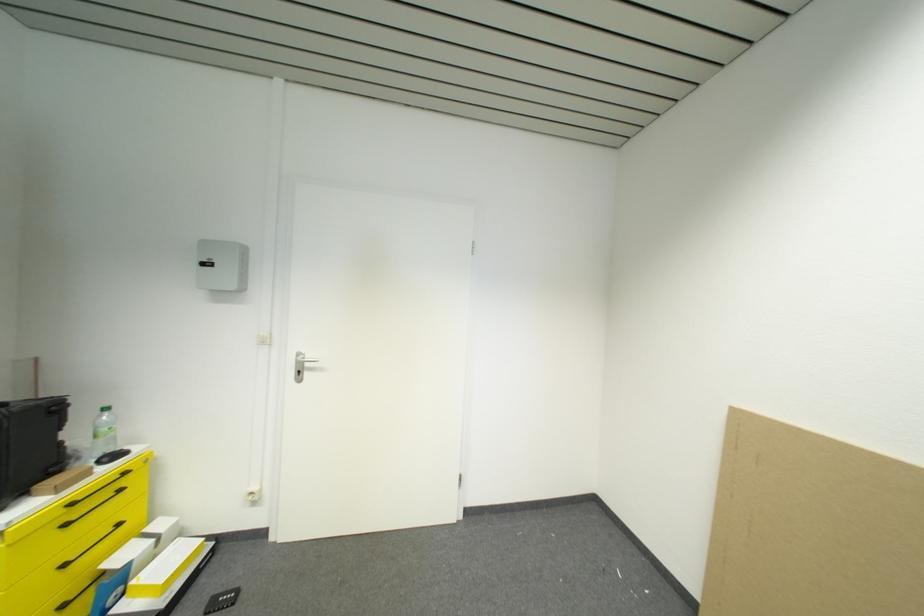
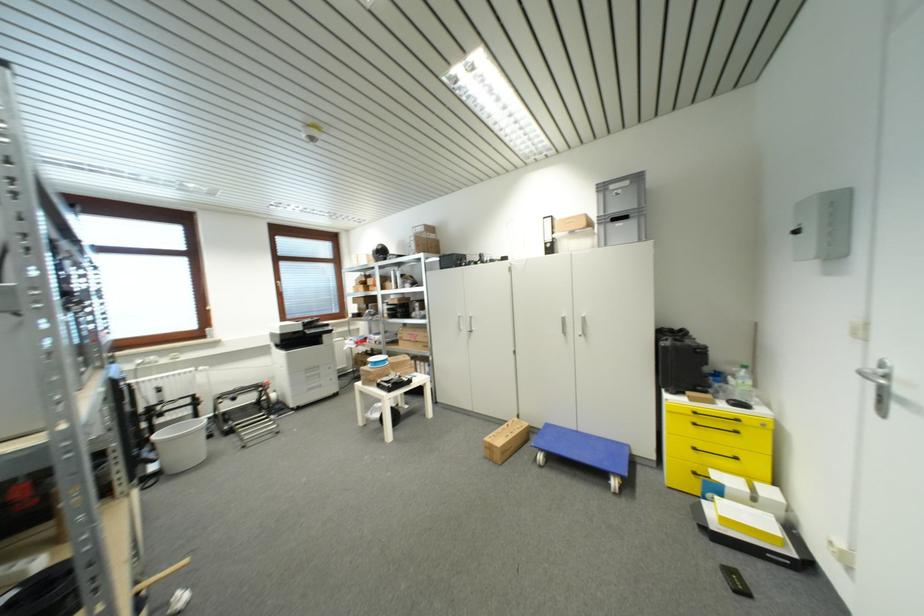
In the second image, find the point that corresponds to point (315, 371) in the first image.

(909, 405)